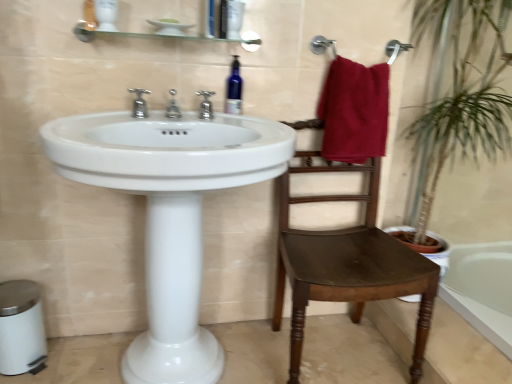
Question: Would you say white glossy sink at center is to the left or to the right of polished chrome faucet at center, the 1th tap in the right-to-left sequence, in the picture?

Choices:
 (A) right
 (B) left

Answer: (B)

Question: From the image's perspective, is white glossy sink at center above or below polished chrome faucet at center, the third tap positioned from the left?

Choices:
 (A) above
 (B) below

Answer: (B)

Question: Based on their relative distances, which object is nearer to the maroon fabric towel at upper right?

Choices:
 (A) blue glass bottle at upper center
 (B) white glossy sink at center
 (C) silver metallic faucet at upper center, the 2th tap when ordered from left to right
 (D) polished chrome faucet at center, the 1th tap in the right-to-left sequence
 (E) dark wood chair at right

Answer: (E)

Question: Which object is positioned closest to the silver metallic faucet at upper center, the 2th tap positioned from the right?

Choices:
 (A) dark wood chair at right
 (B) blue glass bottle at upper center
 (C) polished chrome faucet at center, the third tap from the right
 (D) polished chrome faucet at center, the 1th tap in the right-to-left sequence
 (E) white glossy sink at center

Answer: (C)